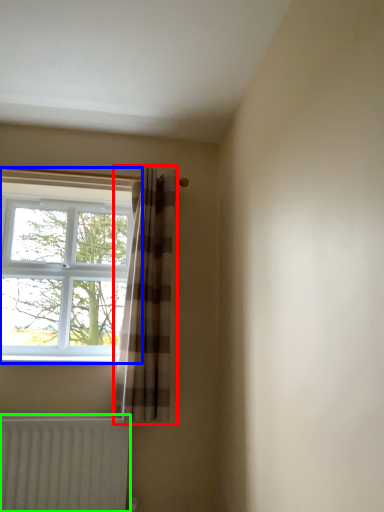
Question: Based on their relative distances, which object is nearer to curtain (highlighted by a red box)? Choose from window (highlighted by a blue box) and radiator (highlighted by a green box).

Choices:
 (A) window
 (B) radiator

Answer: (B)